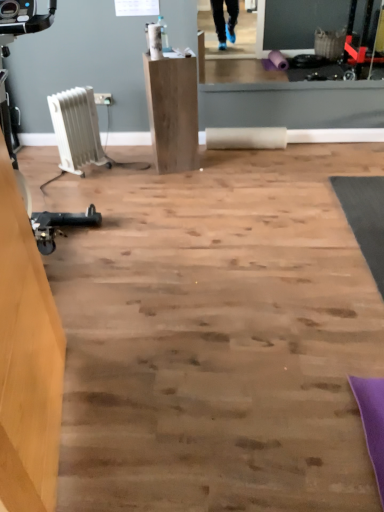
Find the location of a particular element. free location to the right of white plastic radiator at left is located at coordinates (123, 172).